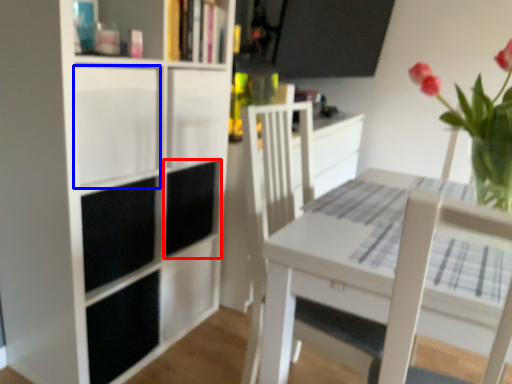
Question: Which point is further to the camera, cabinet (highlighted by a red box) or cabinet (highlighted by a blue box)?

Choices:
 (A) cabinet
 (B) cabinet

Answer: (A)